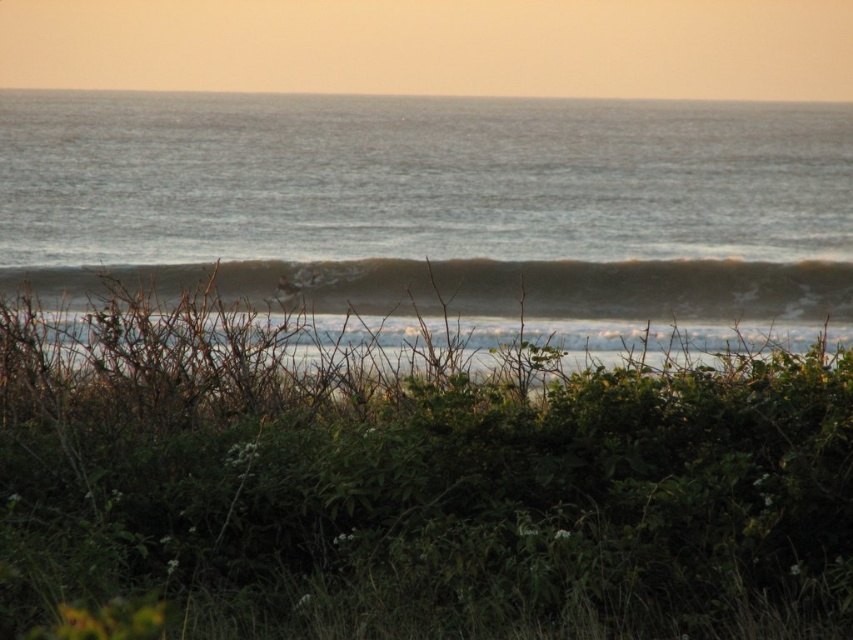
Question: Which object is the closest to the green leafy bush at center?

Choices:
 (A) blue water at center
 (B) white foam wave at center

Answer: (B)

Question: Among these objects, which one is farthest from the camera?

Choices:
 (A) white foam wave at center
 (B) blue water at center
 (C) green leafy bush at center

Answer: (B)

Question: Estimate the real-world distances between objects in this image. Which object is closer to the blue water at center?

Choices:
 (A) white foam wave at center
 (B) green leafy bush at center

Answer: (A)

Question: Does green leafy bush at center have a smaller size compared to white foam wave at center?

Choices:
 (A) yes
 (B) no

Answer: (A)

Question: Where is blue water at center located in relation to white foam wave at center in the image?

Choices:
 (A) right
 (B) left

Answer: (B)

Question: Is blue water at center positioned in front of white foam wave at center?

Choices:
 (A) no
 (B) yes

Answer: (A)